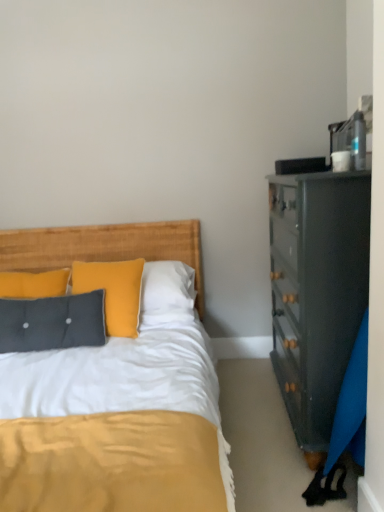
Question: Does point [102, 334] appear closer or farther from the camera than point [13, 238]?

Choices:
 (A) farther
 (B) closer

Answer: (B)

Question: Would you say textured gray pillow at left is inside or outside woven wood headboard at center?

Choices:
 (A) inside
 (B) outside

Answer: (B)

Question: Considering the positions of textured gray pillow at left and woven wood headboard at center in the image, is textured gray pillow at left wider or thinner than woven wood headboard at center?

Choices:
 (A) thin
 (B) wide

Answer: (B)

Question: Does point (203, 287) appear closer or farther from the camera than point (1, 304)?

Choices:
 (A) farther
 (B) closer

Answer: (A)

Question: From a real-world perspective, is woven wood headboard at center physically located above or below textured gray pillow at left?

Choices:
 (A) below
 (B) above

Answer: (B)

Question: Considering the positions of woven wood headboard at center and textured gray pillow at left in the image, is woven wood headboard at center taller or shorter than textured gray pillow at left?

Choices:
 (A) tall
 (B) short

Answer: (A)

Question: Is woven wood headboard at center to the left or to the right of textured gray pillow at left in the image?

Choices:
 (A) left
 (B) right

Answer: (B)